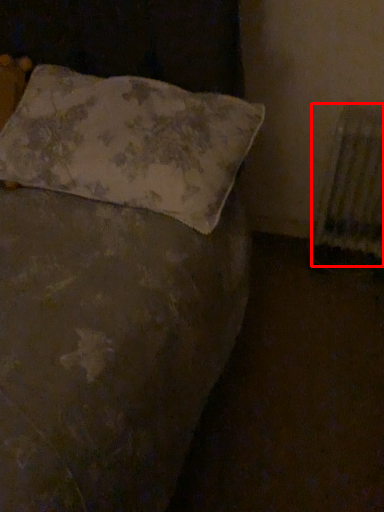
Question: From the image's perspective, where is radiator (annotated by the red box) located relative to pillow?

Choices:
 (A) above
 (B) below

Answer: (B)